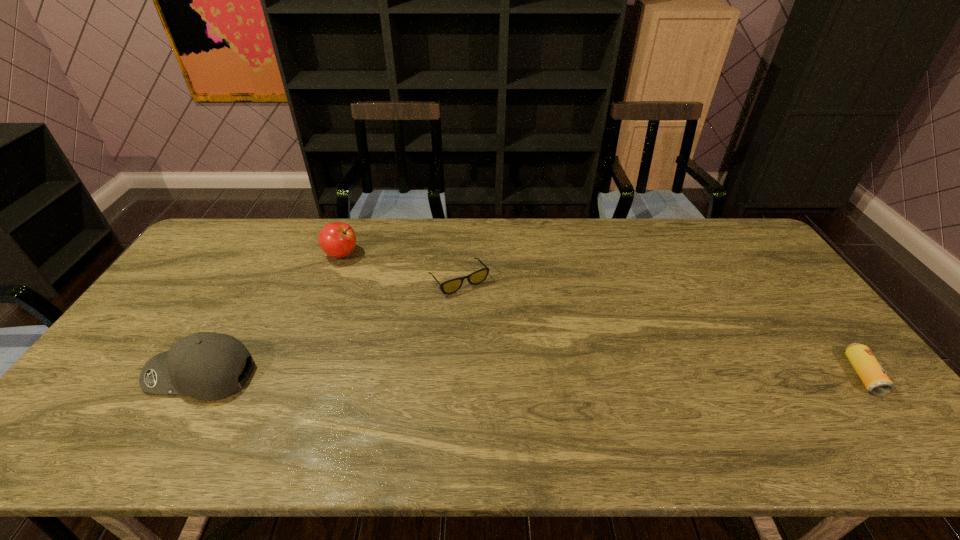
Identify the location of vacant spot on the desktop that is between the leftmost object and the rightmost object and is positioned on the front-facing side of the second object from right to left. The height and width of the screenshot is (540, 960). (532, 375).

Locate an element on the screen. The width and height of the screenshot is (960, 540). vacant space on the desktop that is between the baseball cap and the beer can and is positioned on the stem of the apple is located at coordinates (438, 375).